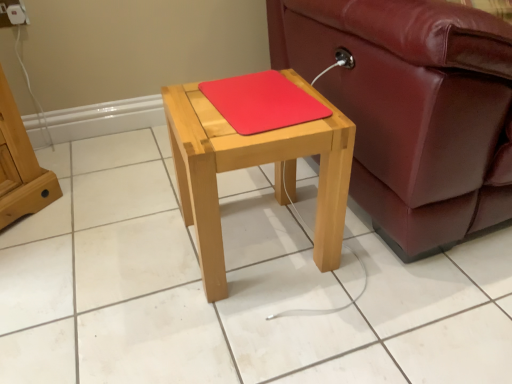
Locate an element on the screen. Image resolution: width=512 pixels, height=384 pixels. blank space above natural wood table at center (from a real-world perspective) is located at coordinates (253, 104).